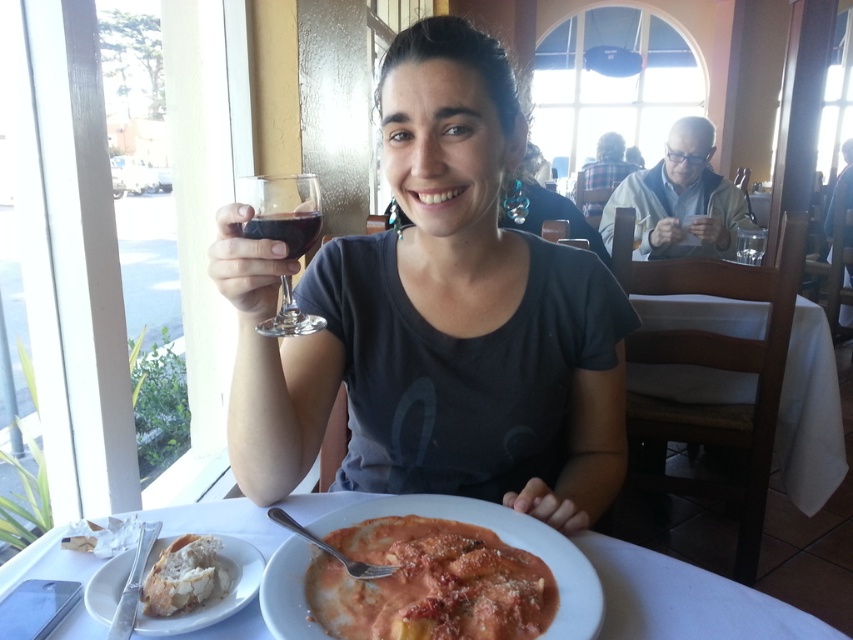
Does white glossy plate at lower center have a larger size compared to smooth creamy pasta at center?

Yes.

Between white glossy plate at lower center and smooth creamy pasta at center, which one has less height?

smooth creamy pasta at center is shorter.

Does point (165, 525) come behind point (457, 556)?

Yes.

At what (x,y) coordinates should I click in order to perform the action: click on white glossy plate at lower center. Please return your answer as a coordinate pair (x, y). The height and width of the screenshot is (640, 853). Looking at the image, I should click on (686, 600).

Can you confirm if matte glass at center is positioned above white crusty bread at lower left?

Yes.

Locate an element on the screen. matte glass at center is located at coordinates (436, 317).

Is point (224, 550) more distant than point (292, 237)?

Yes, point (224, 550) is farther from viewer.

Is point (257, 552) positioned after point (291, 211)?

Yes, it is behind point (291, 211).

Image resolution: width=853 pixels, height=640 pixels. Identify the location of white matte plate at lower left. (219, 600).